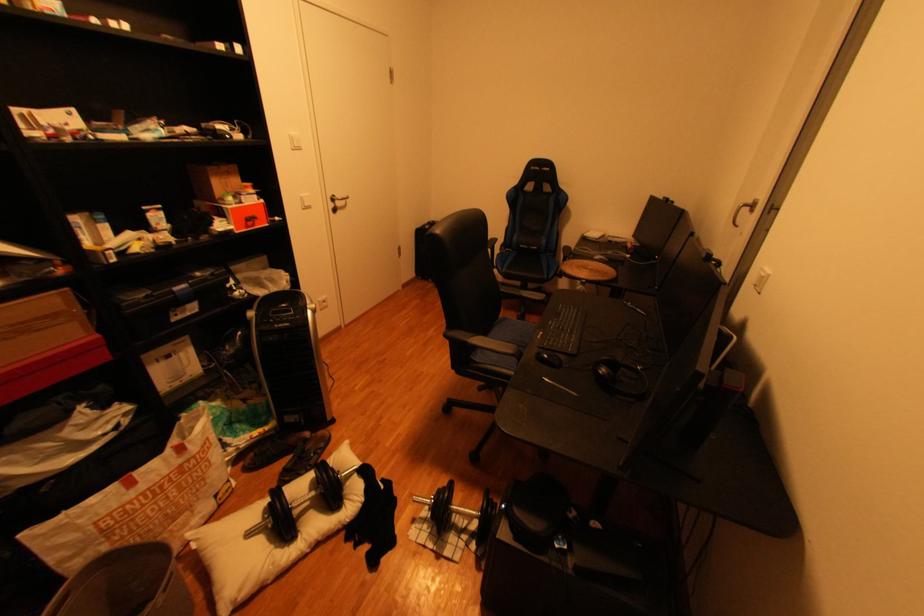
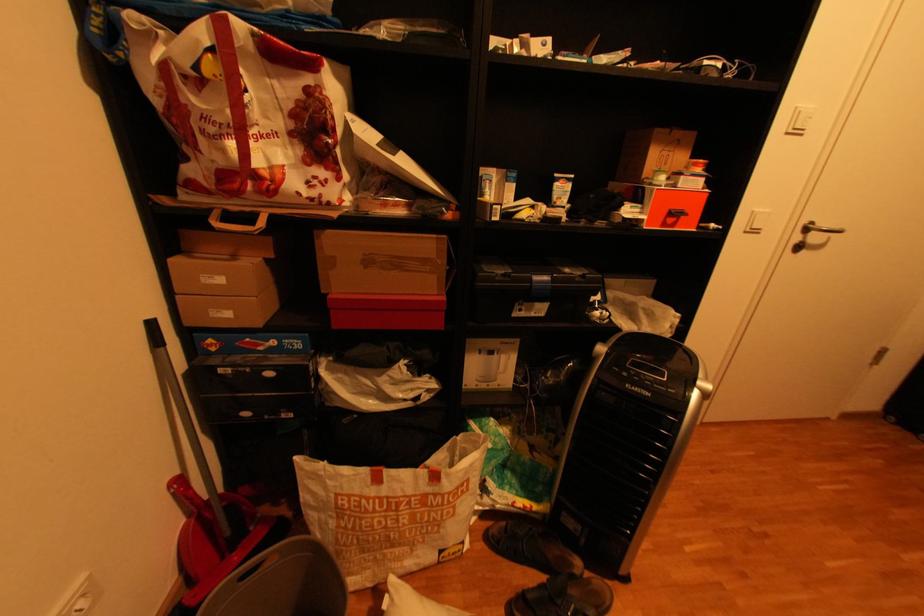
Question: Based on the continuous images, in which direction is the camera rotating? Reply with the corresponding letter.

Choices:
 (A) Left
 (B) Right
 (C) Up
 (D) Down

Answer: (A)